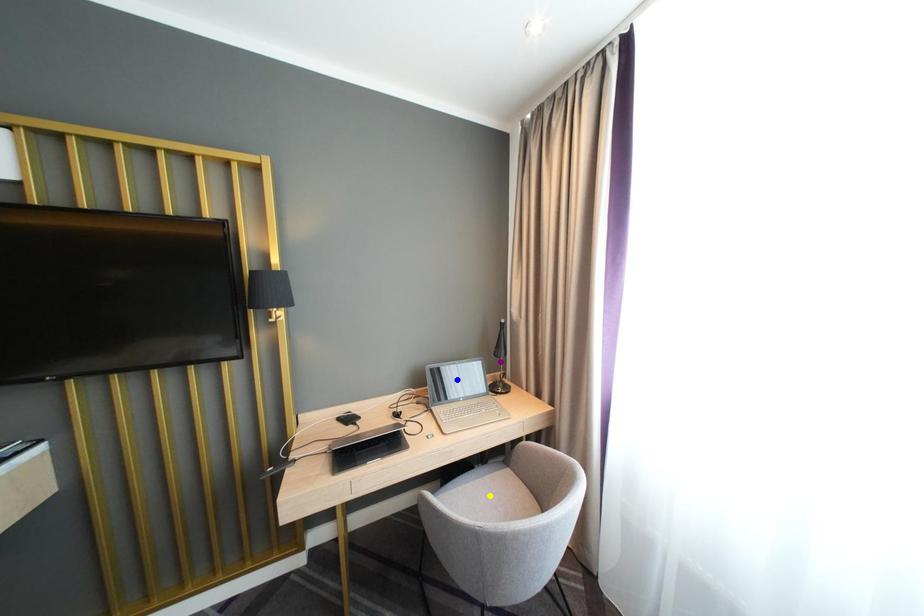
Order these from nearest to farthest:
- blue point
- yellow point
- purple point

purple point
blue point
yellow point